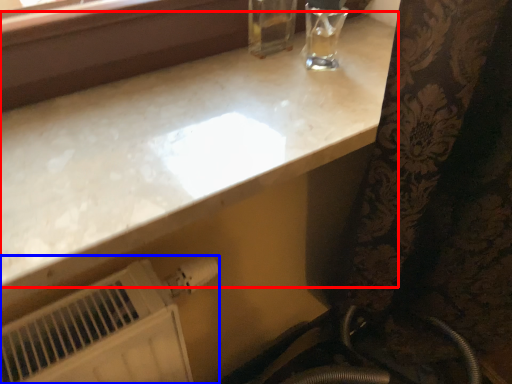
Question: Which point is further to the camera, countertop (highlighted by a red box) or water heater (highlighted by a blue box)?

Choices:
 (A) countertop
 (B) water heater

Answer: (B)